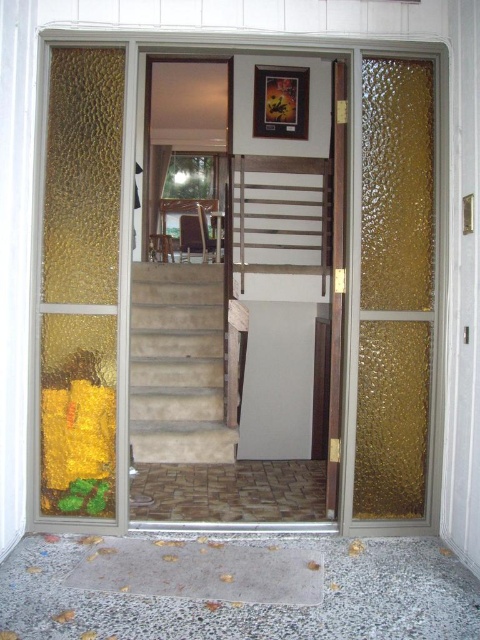
Which is more to the left, transparent glass door at center or beige carpeted stairs at center?

beige carpeted stairs at center

Is transparent glass door at center to the left of beige carpeted stairs at center from the viewer's perspective?

No, transparent glass door at center is not to the left of beige carpeted stairs at center.

Does point (342, 337) lie in front of point (205, 323)?

Yes, it is in front of point (205, 323).

Identify the location of transparent glass door at center. This screenshot has width=480, height=640. (240, 285).

Which is above, transparent glass door at center or wooden at center?

transparent glass door at center is higher up.

Who is more distant from viewer, (59,209) or (261,180)?

The point (261,180) is behind.

Where is `transparent glass door at center`? The width and height of the screenshot is (480, 640). transparent glass door at center is located at coordinates (240, 285).

Can you confirm if beige carpeted stairs at center is thinner than wooden at center?

In fact, beige carpeted stairs at center might be wider than wooden at center.

Between point (202, 401) and point (285, 192), which one is positioned in front?

Point (202, 401)

At what (x,y) coordinates should I click in order to perform the action: click on beige carpeted stairs at center. Please return your answer as a coordinate pair (x, y). The image size is (480, 640). Looking at the image, I should click on (178, 364).